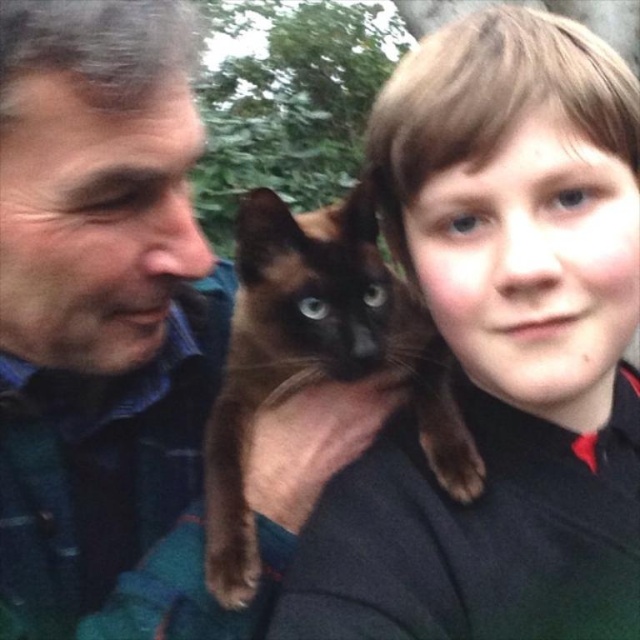
You are taking a selfie with two people and a cat. The cat is at a specific coordinate. If the bottom left corner of the image is considered as the origin point, what are the coordinates of the brown fur cat at upper center?

The coordinates of the brown fur cat at upper center are at point (500,349).

You are a photographer taking a selfie with two people and two cats. You need to ensure there is enough space between the two brown fur cats to avoid overlapping in the photo. The minimum required distance between them is 6 inches. Based on the scene description, will the current positioning of the brown fur cat at upper center and the brown fur cat at center allow for a clear photo without overlapping?

The brown fur cat at upper center is 5.95 inches away from the brown fur cat at center. Since the required distance is 6 inches, the current spacing is slightly insufficient, so the cats may overlap in the photo. Adjust their positions to increase the distance by at least 0.05 inches.

You are taking a selfie with two people and a cat. You want to make sure the cat is centered between them. Based on the image, is the brown fur cat at upper center positioned to the left or right of the brown fur cat at center?

The brown fur cat at upper center is positioned on the right side of brown fur cat at center.